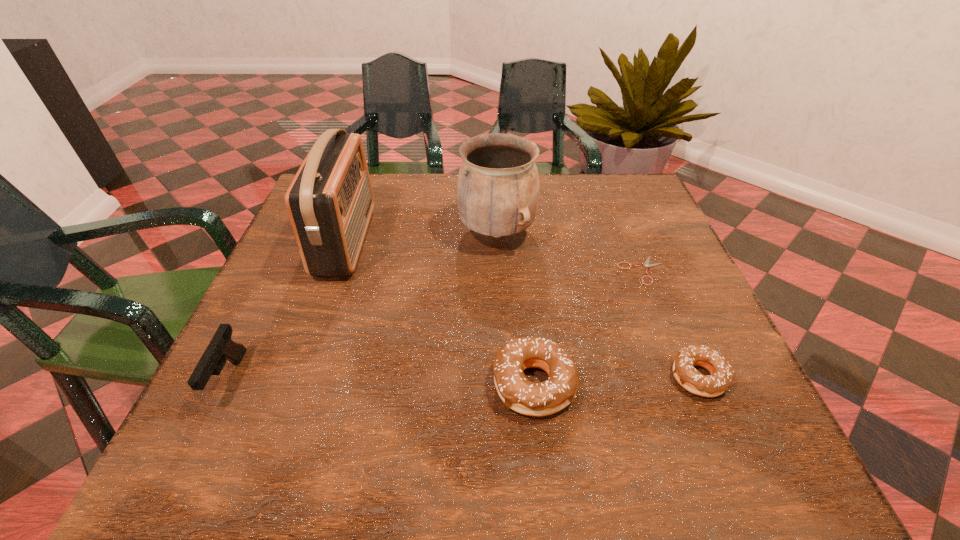
Please point a spot to add another doughnut on the left. Please provide its 2D coordinates. Your answer should be formatted as a tuple, i.e. [(x, y)], where the tuple contains the x and y coordinates of a point satisfying the conditions above.

[(365, 392)]